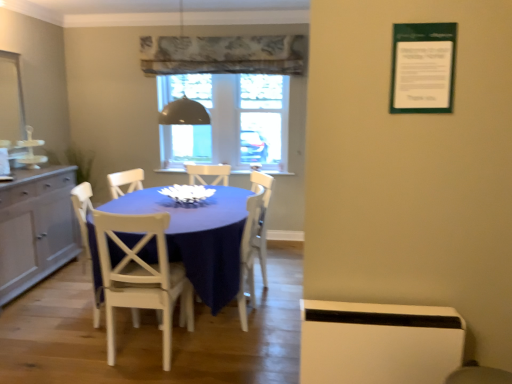
Find the location of a particular element. This screenshot has width=512, height=384. metallic dome at upper center is located at coordinates (184, 113).

This screenshot has height=384, width=512. In order to click on white wood chair at center, the 3th chair when ordered from right to left in this screenshot , I will do `click(83, 214)`.

What do you see at coordinates (142, 277) in the screenshot? The width and height of the screenshot is (512, 384). I see `white painted wood chair at center, placed as the second chair when sorted from left to right` at bounding box center [142, 277].

Describe the element at coordinates (199, 237) in the screenshot. I see `blue fabric table at center` at that location.

I want to click on white wood chair at center, which ranks as the first chair in back-to-front order, so click(x=261, y=219).

Is white wood chair at center, acting as the second chair starting from the back, outside of blue fabric table at center?

Actually, white wood chair at center, acting as the second chair starting from the back, is within blue fabric table at center.

Find the location of a particular element. kitchen & dining room table in front of the white wood chair at center, acting as the second chair starting from the back is located at coordinates (199, 237).

From the image's perspective, is white wood chair at center, the 3th chair when ordered from right to left, above or below blue fabric table at center?

Clearly, from the image's perspective, white wood chair at center, the 3th chair when ordered from right to left, is below blue fabric table at center.

Considering the sizes of objects white wood chair at center, which is the first chair from left to right, and blue fabric table at center in the image provided, who is shorter, white wood chair at center, which is the first chair from left to right, or blue fabric table at center?

Standing shorter between the two is blue fabric table at center.

How many degrees apart are the facing directions of matte gray cabinet at left and white painted wood chair at center, marked as the first chair in a front-to-back arrangement?

They differ by 94.6 degrees in their facing directions.

Is matte gray cabinet at left thinner than white painted wood chair at center, which ranks as the third chair in back-to-front order?

Indeed, matte gray cabinet at left has a lesser width compared to white painted wood chair at center, which ranks as the third chair in back-to-front order.

Which of these two, matte gray cabinet at left or white painted wood chair at center, placed as the second chair when sorted from left to right, is bigger?

matte gray cabinet at left is bigger.

From a real-world perspective, between matte gray cabinet at left and white painted wood chair at center, placed as the second chair when sorted from left to right, who is vertically lower?

From a 3D spatial view, matte gray cabinet at left is below.

Could black glass dome at center, which appears as the second window screen when viewed from the right, be considered to be inside white wood chair at center, which is the first chair from left to right?

No, black glass dome at center, which appears as the second window screen when viewed from the right, is located outside of white wood chair at center, which is the first chair from left to right.

From the image's perspective, which object appears higher, white wood chair at center, acting as the second chair starting from the back, or black glass dome at center, which appears as the second window screen when viewed from the right?

From the image's view, black glass dome at center, which appears as the second window screen when viewed from the right, is above.

Considering the points (87, 211) and (172, 157), which point is in front, point (87, 211) or point (172, 157)?

The point (87, 211) is in front.

Consider the image. Between white wood chair at center, the 2th chair in the front-to-back sequence, and black glass dome at center, which appears as the second window screen when viewed from the right, which one appears on the right side from the viewer's perspective?

From the viewer's perspective, black glass dome at center, which appears as the second window screen when viewed from the right, appears more on the right side.

The image size is (512, 384). I want to click on the 1st chair below the metallic dome at upper center (from a real-world perspective), so click(x=261, y=219).

How different are the orientations of white wood chair at center, which ranks as the first chair in back-to-front order, and metallic dome at upper center in degrees?

The angular difference between white wood chair at center, which ranks as the first chair in back-to-front order, and metallic dome at upper center is 69 degrees.

Which object is closer to the camera, white wood chair at center, acting as the 3th chair starting from the front, or metallic dome at upper center?

metallic dome at upper center is more forward.

Considering the relative sizes of white wood chair at center, which ranks as the first chair in back-to-front order, and metallic dome at upper center in the image provided, is white wood chair at center, which ranks as the first chair in back-to-front order, wider than metallic dome at upper center?

Yes.

Does white wood chair at center, which ranks as the first chair in back-to-front order, contain matte gray cabinet at left?

No, matte gray cabinet at left is not inside white wood chair at center, which ranks as the first chair in back-to-front order.

How much distance is there between white wood chair at center, which ranks as the first chair in back-to-front order, and matte gray cabinet at left?

5.67 feet.

Is white wood chair at center, which appears as the 3th chair when viewed from the left, oriented towards matte gray cabinet at left?

Yes, white wood chair at center, which appears as the 3th chair when viewed from the left, is turned towards matte gray cabinet at left.

Is white wood chair at center, acting as the 3th chair starting from the front, beside matte gray cabinet at left?

They are not placed beside each other.

Based on the photo, could blue fabric table at center be considered to be inside white painted wood chair at center, the second chair from the right?

No.

Is point (139, 222) closer to viewer compared to point (195, 225)?

That is True.

From a real-world perspective, is white painted wood chair at center, placed as the second chair when sorted from left to right, above or below blue fabric table at center?

In terms of real-world spatial position, white painted wood chair at center, placed as the second chair when sorted from left to right, is above blue fabric table at center.

Considering the sizes of objects white painted wood chair at center, which ranks as the third chair in back-to-front order, and blue fabric table at center in the image provided, who is wider, white painted wood chair at center, which ranks as the third chair in back-to-front order, or blue fabric table at center?

With larger width is blue fabric table at center.

Considering the points (134, 222) and (264, 191), which point is in front, point (134, 222) or point (264, 191)?

The point (134, 222) is closer to the camera.

Measure the distance from white painted wood chair at center, which ranks as the third chair in back-to-front order, to white wood chair at center, which appears as the 3th chair when viewed from the left.

white painted wood chair at center, which ranks as the third chair in back-to-front order, and white wood chair at center, which appears as the 3th chair when viewed from the left, are 3.82 feet apart.

From a real-world perspective, is white painted wood chair at center, marked as the first chair in a front-to-back arrangement, located higher than white wood chair at center, acting as the 3th chair starting from the front?

Incorrect, from a real-world perspective, white painted wood chair at center, marked as the first chair in a front-to-back arrangement, is lower than white wood chair at center, acting as the 3th chair starting from the front.

There is a white wood chair at center, the 1th chair in the right-to-left sequence. Where is `the 1st chair below it (from a real-world perspective)`? The height and width of the screenshot is (384, 512). the 1st chair below it (from a real-world perspective) is located at coordinates (142, 277).

The image size is (512, 384). In order to click on the 1st chair above the blue fabric table at center (from a real-world perspective) in this screenshot , I will do `click(83, 214)`.

There is a matte gray cabinet at left. Where is `the 2nd chair below it (from the image's perspective)`? Image resolution: width=512 pixels, height=384 pixels. the 2nd chair below it (from the image's perspective) is located at coordinates (142, 277).

Considering their positions, is transparent glass window at center, positioned as the second window screen in left-to-right order, positioned closer to blue fabric table at center than black glass dome at center, which appears as the second window screen when viewed from the right?

The object closer to blue fabric table at center is transparent glass window at center, positioned as the second window screen in left-to-right order.

Estimate the real-world distances between objects in this image. Which object is further from white painted wood chair at center, the second chair from the right, black glass dome at center, which is the first window screen in left-to-right order, or white wood chair at center, the 1th chair in the right-to-left sequence?

Among the two, black glass dome at center, which is the first window screen in left-to-right order, is located further to white painted wood chair at center, the second chair from the right.

Considering their positions, is white wood chair at center, acting as the second chair starting from the back, positioned further to metallic dome at upper center than transparent glass window at center, positioned as the second window screen in left-to-right order?

The object further to metallic dome at upper center is transparent glass window at center, positioned as the second window screen in left-to-right order.

Looking at this image, when comparing their distances from black glass dome at center, which is the first window screen in left-to-right order, does white painted wood chair at center, the second chair from the right, or white wood chair at center, the 1th chair in the right-to-left sequence, seem closer?

The object closer to black glass dome at center, which is the first window screen in left-to-right order, is white wood chair at center, the 1th chair in the right-to-left sequence.

Considering their positions, is white wood chair at center, which is the first chair from left to right, positioned closer to black glass dome at center, which is the first window screen in left-to-right order, than blue fabric table at center?

white wood chair at center, which is the first chair from left to right, is closer to black glass dome at center, which is the first window screen in left-to-right order.

Which object lies further to the anchor point white painted wood chair at center, which ranks as the third chair in back-to-front order, black glass dome at center, which is the first window screen in left-to-right order, or transparent glass window at center, marked as the 1th window screen in a right-to-left arrangement?

Based on the image, transparent glass window at center, marked as the 1th window screen in a right-to-left arrangement, appears to be further to white painted wood chair at center, which ranks as the third chair in back-to-front order.

Which object lies further to the anchor point matte gray cabinet at left, transparent glass window at center, marked as the 1th window screen in a right-to-left arrangement, or black glass dome at center, which is the first window screen in left-to-right order?

transparent glass window at center, marked as the 1th window screen in a right-to-left arrangement.

Considering their positions, is blue fabric table at center positioned closer to white painted wood chair at center, which ranks as the third chair in back-to-front order, than black glass dome at center, which is the first window screen in left-to-right order?

Among the two, blue fabric table at center is located nearer to white painted wood chair at center, which ranks as the third chair in back-to-front order.

Find the location of a particular element. light fixture between matte gray cabinet at left and black glass dome at center, which is the first window screen in left-to-right order, in the front-back direction is located at coordinates (184, 113).

Where is `light fixture located between white wood chair at center, the 3th chair when ordered from right to left, and transparent glass window at center, marked as the 1th window screen in a right-to-left arrangement, in the depth direction`? The width and height of the screenshot is (512, 384). light fixture located between white wood chair at center, the 3th chair when ordered from right to left, and transparent glass window at center, marked as the 1th window screen in a right-to-left arrangement, in the depth direction is located at coordinates [184, 113].

Locate an element on the screen. Image resolution: width=512 pixels, height=384 pixels. light fixture between white wood chair at center, the 3th chair when ordered from right to left, and black glass dome at center, which appears as the second window screen when viewed from the right, along the z-axis is located at coordinates (184, 113).

The width and height of the screenshot is (512, 384). Identify the location of cabinetry between blue fabric table at center and transparent glass window at center, marked as the 1th window screen in a right-to-left arrangement, from front to back. (35, 228).